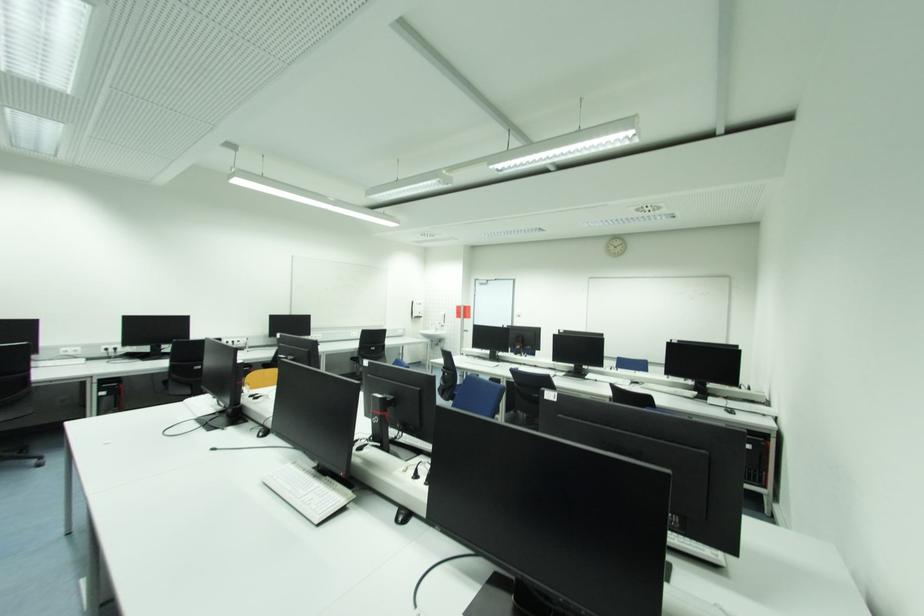
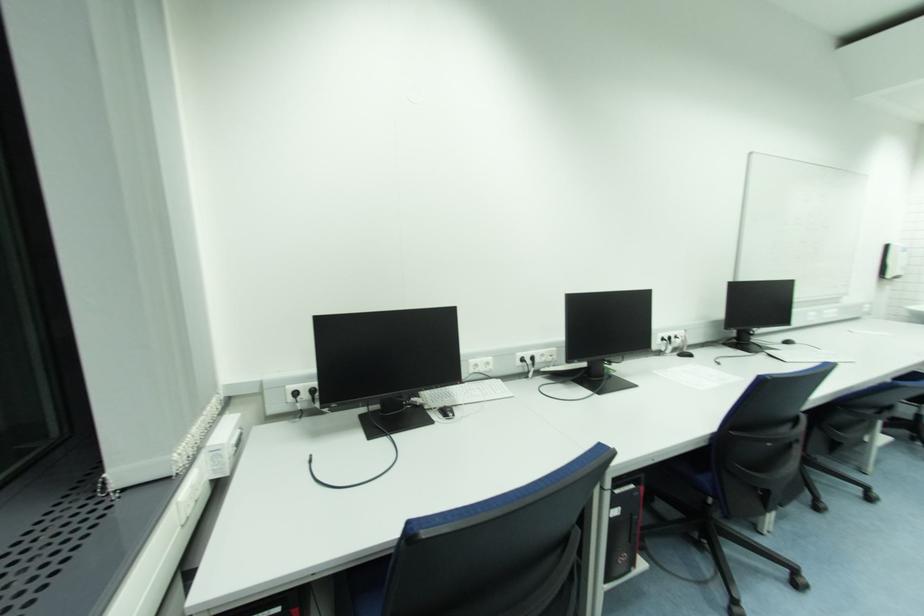
Find the pixel in the second image that matches point (416, 304) in the first image.

(892, 248)